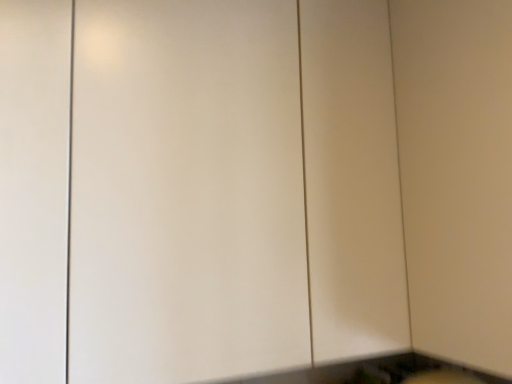
The height and width of the screenshot is (384, 512). What do you see at coordinates (456, 174) in the screenshot?
I see `white matte door at right` at bounding box center [456, 174].

At what (x,y) coordinates should I click in order to perform the action: click on white matte door at right. Please return your answer as a coordinate pair (x, y). This screenshot has height=384, width=512. Looking at the image, I should click on (456, 174).

Locate an element on the screen. The width and height of the screenshot is (512, 384). white matte door at right is located at coordinates (456, 174).